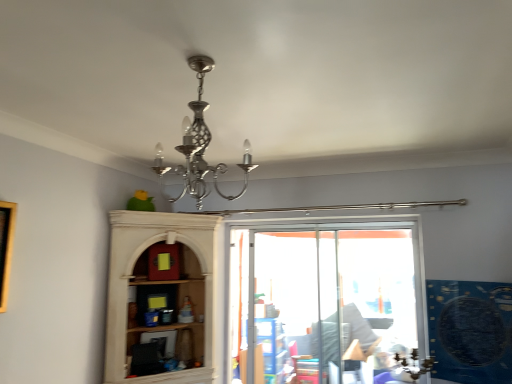
Question: Can you see blue plastic shelf at center touching wooden picture frame at left?

Choices:
 (A) no
 (B) yes

Answer: (A)

Question: Would you consider blue plastic shelf at center to be distant from wooden picture frame at left?

Choices:
 (A) no
 (B) yes

Answer: (B)

Question: Would you say blue plastic shelf at center contains wooden picture frame at left?

Choices:
 (A) yes
 (B) no

Answer: (B)

Question: Can you confirm if blue plastic shelf at center is wider than wooden picture frame at left?

Choices:
 (A) no
 (B) yes

Answer: (B)

Question: Is blue plastic shelf at center taller than wooden picture frame at left?

Choices:
 (A) yes
 (B) no

Answer: (A)

Question: Is the depth of blue plastic shelf at center greater than that of wooden picture frame at left?

Choices:
 (A) yes
 (B) no

Answer: (A)

Question: Is polished silver chandelier at center a part of wooden picture frame at left?

Choices:
 (A) yes
 (B) no

Answer: (B)

Question: From a real-world perspective, is wooden picture frame at left beneath polished silver chandelier at center?

Choices:
 (A) yes
 (B) no

Answer: (A)

Question: Is wooden picture frame at left bigger than polished silver chandelier at center?

Choices:
 (A) no
 (B) yes

Answer: (A)

Question: Is the depth of wooden picture frame at left greater than that of polished silver chandelier at center?

Choices:
 (A) no
 (B) yes

Answer: (B)

Question: Is wooden picture frame at left taller than polished silver chandelier at center?

Choices:
 (A) yes
 (B) no

Answer: (A)

Question: Is wooden picture frame at left smaller than polished silver chandelier at center?

Choices:
 (A) no
 (B) yes

Answer: (B)

Question: Considering the relative sizes of polished silver chandelier at center and wooden picture frame at left in the image provided, is polished silver chandelier at center wider than wooden picture frame at left?

Choices:
 (A) no
 (B) yes

Answer: (B)